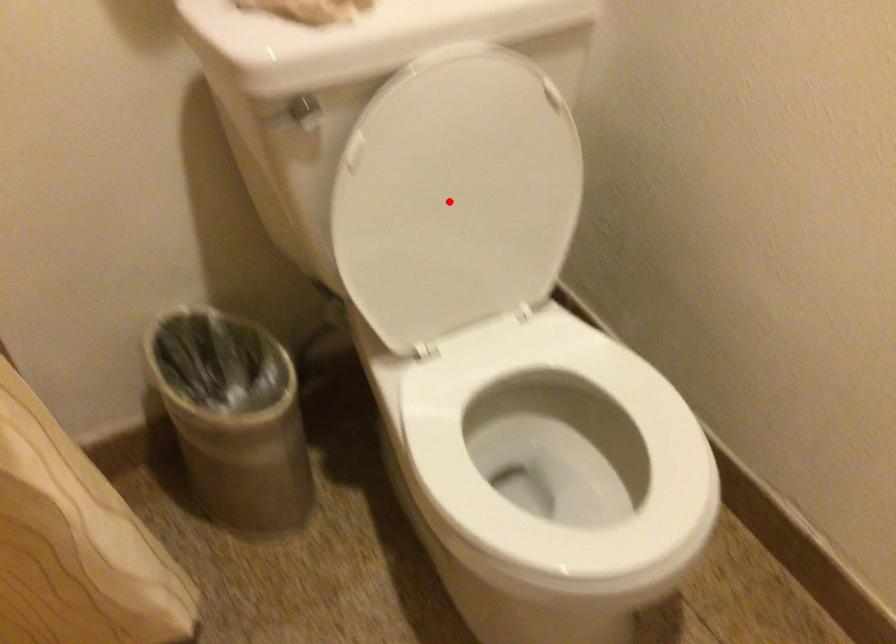
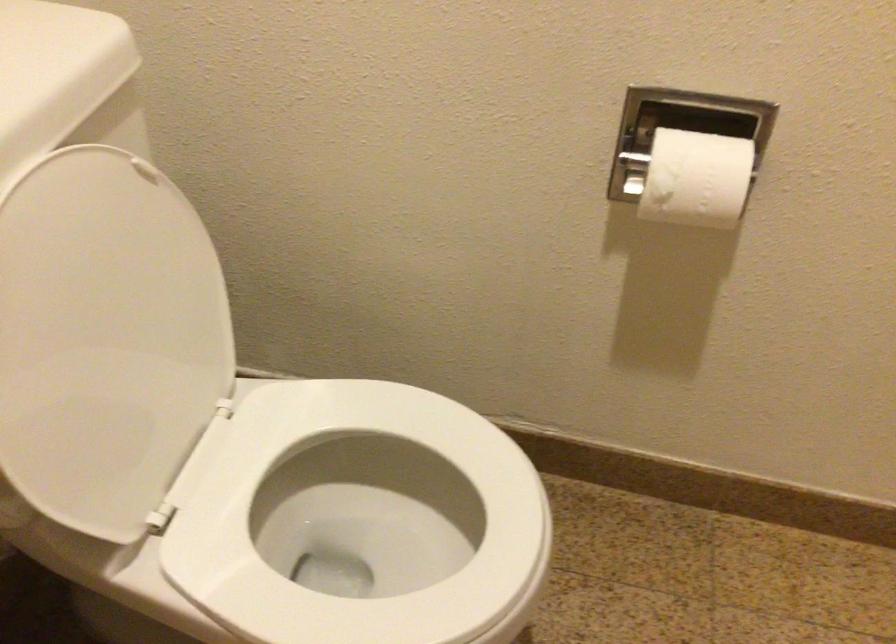
The point at the highlighted location is marked in the first image. Where is the corresponding point in the second image?

(105, 339)